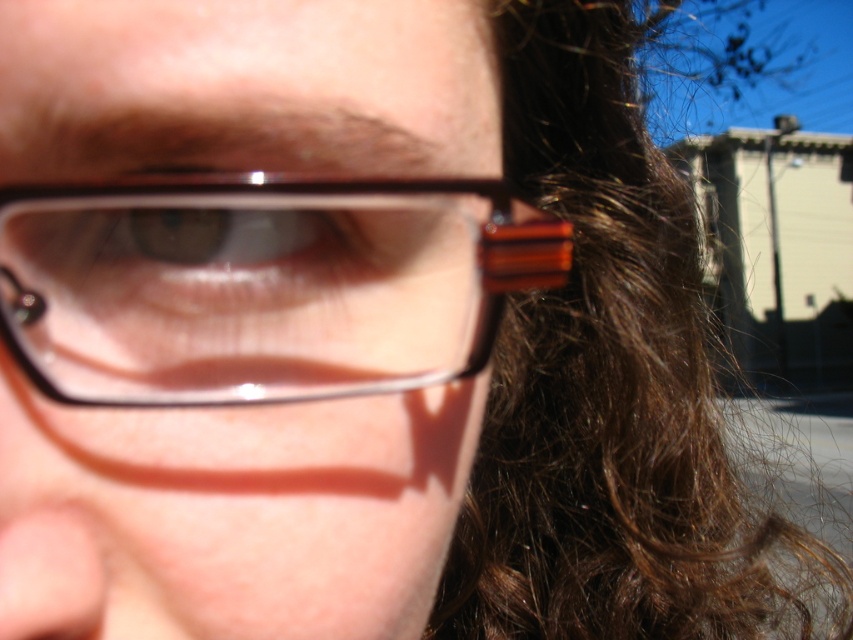
Question: Is brown shiny hair at right above brown glossy eye at center?

Choices:
 (A) no
 (B) yes

Answer: (A)

Question: Which is nearer to the translucent plastic glasses at center?

Choices:
 (A) brown shiny hair at right
 (B) brown glossy eye at center

Answer: (B)

Question: Among these points, which one is farthest from the camera?

Choices:
 (A) (639, 262)
 (B) (433, 353)

Answer: (A)

Question: Where is translucent plastic glasses at center located in relation to brown glossy eye at center in the image?

Choices:
 (A) above
 (B) below

Answer: (B)

Question: Which object is closer to the camera taking this photo?

Choices:
 (A) brown glossy eye at center
 (B) translucent plastic glasses at center

Answer: (B)

Question: Observing the image, what is the correct spatial positioning of translucent plastic glasses at center in reference to brown glossy eye at center?

Choices:
 (A) above
 (B) below

Answer: (B)